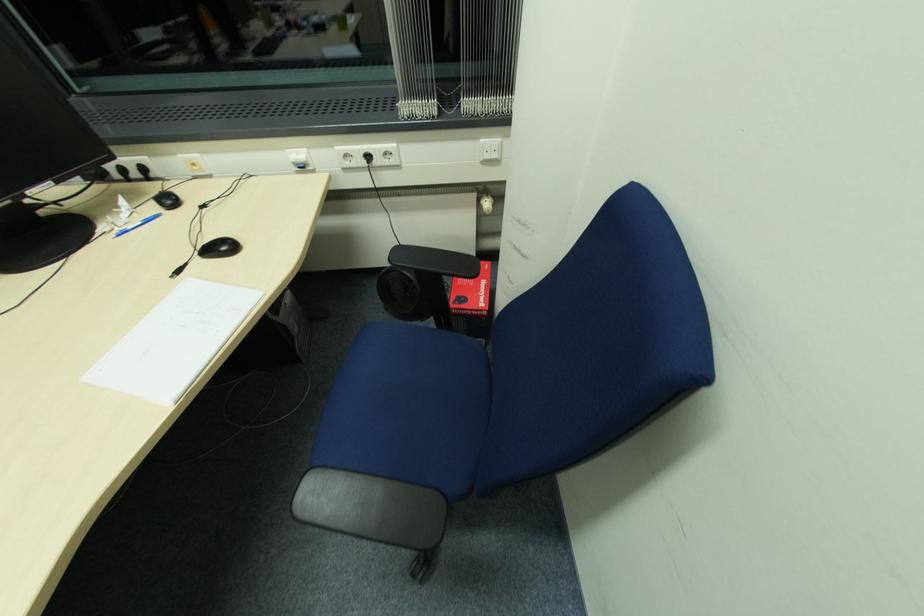
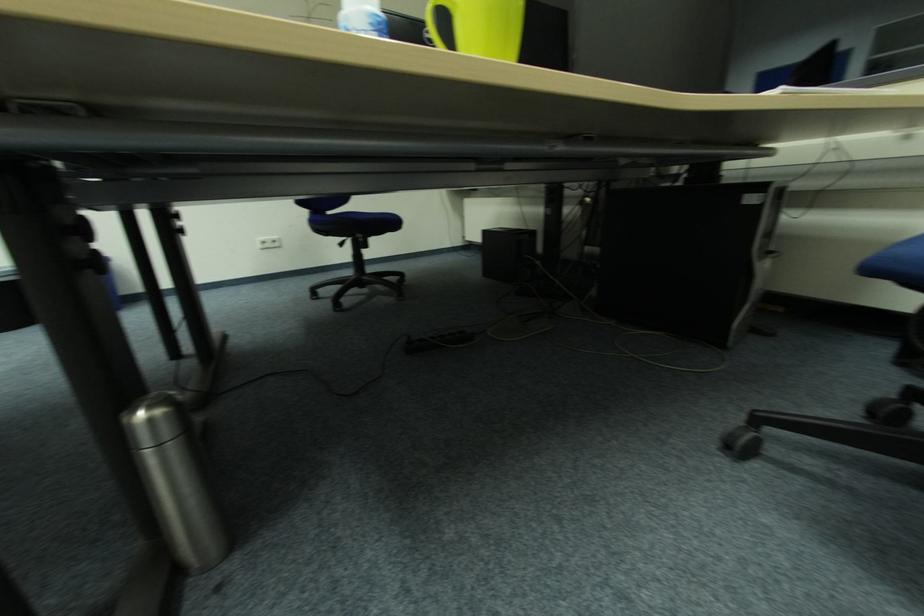
Question: Based on the continuous images, in which direction is the camera rotating? Reply with the corresponding letter.

Choices:
 (A) Left
 (B) Right
 (C) Up
 (D) Down

Answer: (A)